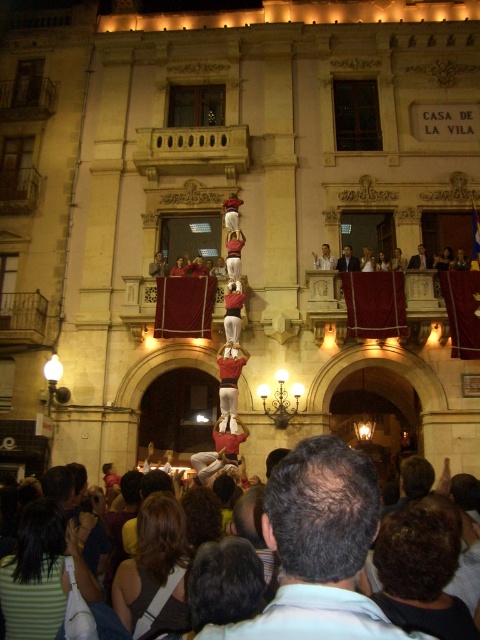
Is smooth white shirt at upper center in front of smooth skin man at center?

That is False.

Which is in front, point (348, 252) or point (420, 243)?

Point (348, 252)

Find the location of `smooth white shirt at upper center`. smooth white shirt at upper center is located at coordinates (348, 260).

Who is more distant from viewer, [335,566] or [229,406]?

The point [229,406] is behind.

Which is below, gray hair at center or red fabric human at center?

gray hair at center is lower down.

Is point (309, 500) less distant than point (230, 348)?

Yes.

Identify the location of gray hair at center. (319, 548).

Is point (236, 397) farther from camera compared to point (345, 259)?

No, it is not.

Is red fabric human at center above smooth white shirt at upper center?

No, red fabric human at center is not above smooth white shirt at upper center.

Which is behind, point (241, 358) or point (357, 259)?

The point (357, 259) is more distant.

Find the location of a particular element. The image size is (480, 640). red fabric human at center is located at coordinates (229, 380).